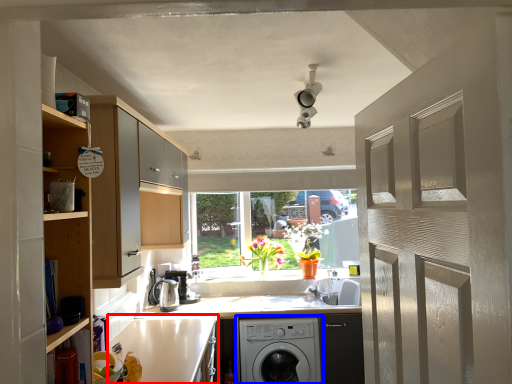
Question: Which point is further to the camera, counter top (highlighted by a red box) or washing machine (highlighted by a blue box)?

Choices:
 (A) counter top
 (B) washing machine

Answer: (B)